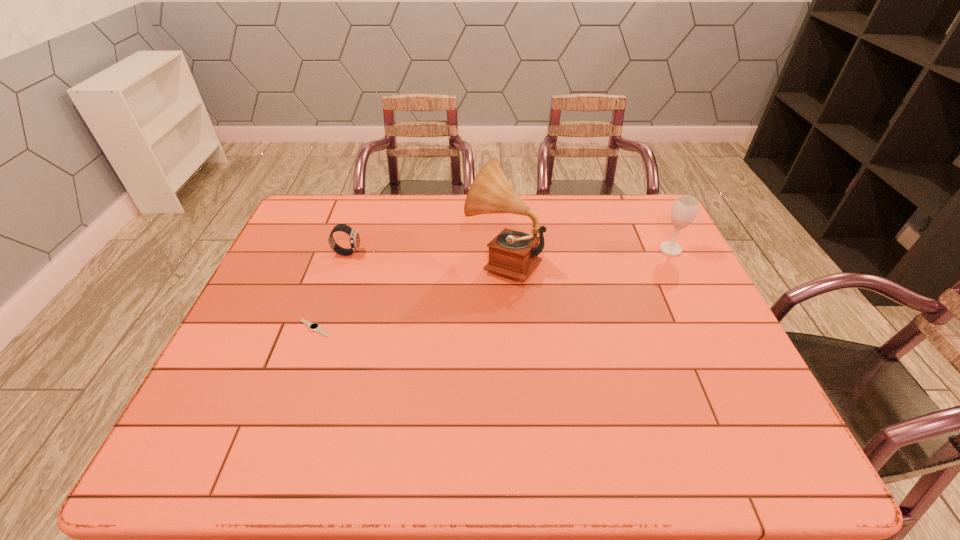
Where is `phonograph record`? The image size is (960, 540). phonograph record is located at coordinates (514, 254).

Where is `the tallest object`? The height and width of the screenshot is (540, 960). the tallest object is located at coordinates (514, 254).

Find the location of `wineglass`. wineglass is located at coordinates (685, 208).

You are a GUI agent. You are given a task and a screenshot of the screen. Output one action in this format:
    pyautogui.click(x=<x>, y=<y>)
    Task: Click on the second tallest object
    The height and width of the screenshot is (540, 960).
    Given the screenshot: What is the action you would take?
    pyautogui.click(x=685, y=208)

This screenshot has height=540, width=960. I want to click on the taller watch, so click(354, 241).

Identify the location of the third tallest object. The image size is (960, 540). (354, 241).

Image resolution: width=960 pixels, height=540 pixels. I want to click on the nearer watch, so click(x=313, y=326).

Where is `the shorter watch`? the shorter watch is located at coordinates (313, 326).

The width and height of the screenshot is (960, 540). Find the location of `free space located 0.310m on the horn of the tallest object`. free space located 0.310m on the horn of the tallest object is located at coordinates (364, 260).

Where is `vacant position located on the horn of the tallest object`? vacant position located on the horn of the tallest object is located at coordinates (x=440, y=260).